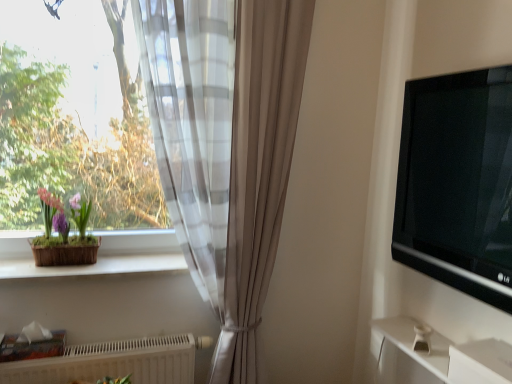
Question: Is the depth of white textured radiator at lower left less than that of sheer white curtain at left?

Choices:
 (A) yes
 (B) no

Answer: (B)

Question: Is white textured radiator at lower left turned away from sheer white curtain at left?

Choices:
 (A) no
 (B) yes

Answer: (B)

Question: Does white textured radiator at lower left have a greater width compared to sheer white curtain at left?

Choices:
 (A) yes
 (B) no

Answer: (B)

Question: Is sheer white curtain at left surrounded by white textured radiator at lower left?

Choices:
 (A) yes
 (B) no

Answer: (B)

Question: Is white textured radiator at lower left not near sheer white curtain at left?

Choices:
 (A) no
 (B) yes

Answer: (A)

Question: Is white textured radiator at lower left placed right next to sheer white curtain at left?

Choices:
 (A) yes
 (B) no

Answer: (B)

Question: Does matte brown pot at left turn towards sheer white curtain at left?

Choices:
 (A) yes
 (B) no

Answer: (B)

Question: Is matte brown pot at left positioned beyond the bounds of sheer white curtain at left?

Choices:
 (A) no
 (B) yes

Answer: (B)

Question: Considering the relative positions of matte brown pot at left and sheer white curtain at left in the image provided, is matte brown pot at left to the right of sheer white curtain at left from the viewer's perspective?

Choices:
 (A) no
 (B) yes

Answer: (A)

Question: From a real-world perspective, is matte brown pot at left below sheer white curtain at left?

Choices:
 (A) yes
 (B) no

Answer: (A)

Question: Does matte brown pot at left have a smaller size compared to sheer white curtain at left?

Choices:
 (A) yes
 (B) no

Answer: (A)

Question: From a real-world perspective, is matte brown pot at left physically above sheer white curtain at left?

Choices:
 (A) yes
 (B) no

Answer: (B)

Question: Is white textured radiator at lower left next to matte brown pot at left?

Choices:
 (A) no
 (B) yes

Answer: (A)